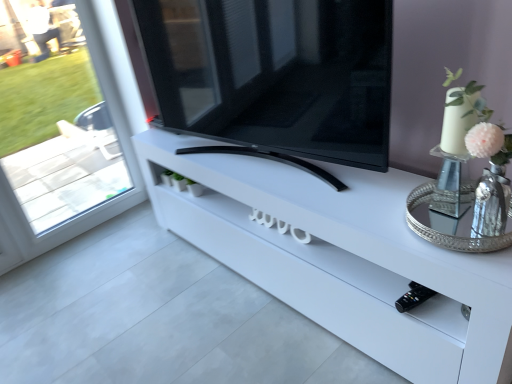
Question: Can we say silver metallic tray at right lies outside white glossy tv stand at center?

Choices:
 (A) yes
 (B) no

Answer: (A)

Question: From a real-world perspective, is silver metallic tray at right located beneath white glossy tv stand at center?

Choices:
 (A) yes
 (B) no

Answer: (B)

Question: From the image's perspective, is silver metallic tray at right below white glossy tv stand at center?

Choices:
 (A) yes
 (B) no

Answer: (B)

Question: From the image's perspective, is silver metallic tray at right on white glossy tv stand at center?

Choices:
 (A) no
 (B) yes

Answer: (B)

Question: Is silver metallic tray at right positioned far away from white glossy tv stand at center?

Choices:
 (A) yes
 (B) no

Answer: (B)

Question: Would you say white glossy tv stand at center is to the left or to the right of silver metallic tray at right in the picture?

Choices:
 (A) left
 (B) right

Answer: (A)

Question: Which is correct: white glossy tv stand at center is inside silver metallic tray at right, or outside of it?

Choices:
 (A) inside
 (B) outside

Answer: (B)

Question: Considering the positions of point (245, 203) and point (486, 249), is point (245, 203) closer or farther from the camera than point (486, 249)?

Choices:
 (A) farther
 (B) closer

Answer: (A)

Question: From the image's perspective, is white glossy tv stand at center located above or below silver metallic tray at right?

Choices:
 (A) above
 (B) below

Answer: (B)

Question: In terms of height, does silver metallic tray at right look taller or shorter compared to transparent glass window at left?

Choices:
 (A) short
 (B) tall

Answer: (A)

Question: Is silver metallic tray at right to the left or to the right of transparent glass window at left in the image?

Choices:
 (A) right
 (B) left

Answer: (A)

Question: Do you think silver metallic tray at right is within transparent glass window at left, or outside of it?

Choices:
 (A) outside
 (B) inside

Answer: (A)

Question: From the image's perspective, is silver metallic tray at right positioned above or below transparent glass window at left?

Choices:
 (A) below
 (B) above

Answer: (A)

Question: In terms of height, does black glossy tv at center look taller or shorter compared to white glossy tv stand at center?

Choices:
 (A) short
 (B) tall

Answer: (B)

Question: From a real-world perspective, is black glossy tv at center positioned above or below white glossy tv stand at center?

Choices:
 (A) above
 (B) below

Answer: (A)